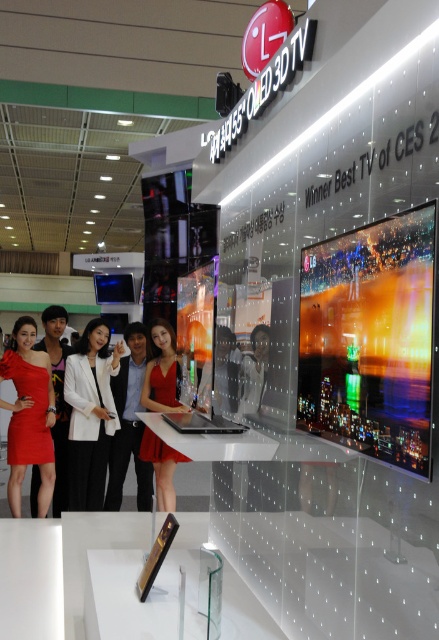
Who is positioned more to the right, white matte blazer at center or matte red dress at lower left?

white matte blazer at center is more to the right.

Locate an element on the screen. This screenshot has height=640, width=439. white matte blazer at center is located at coordinates (89, 413).

Which is behind, point (46, 417) or point (161, 461)?

Positioned behind is point (46, 417).

Measure the distance from matte red dress at lower left to red satin dress at center.

3.69 feet

Locate an element on the screen. matte red dress at lower left is located at coordinates (28, 412).

Is point (111, 368) positioned in front of point (169, 387)?

No, it is behind (169, 387).

Is white matte blazer at center positioned before red satin dress at center?

That is False.

Where is `white matte blazer at center`? white matte blazer at center is located at coordinates (89, 413).

The image size is (439, 640). Find the location of `white matte blazer at center`. white matte blazer at center is located at coordinates (89, 413).